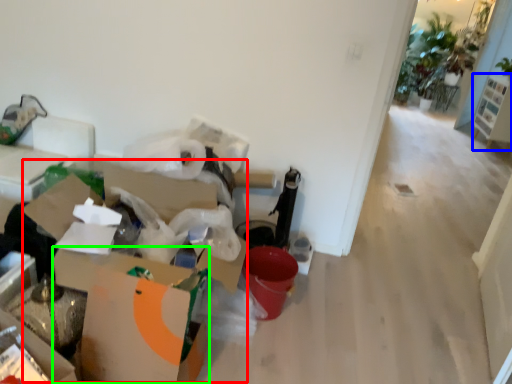
Question: Estimate the real-world distances between objects in this image. Which object is closer to cardboard box (highlighted by a red box), furniture (highlighted by a blue box) or cardboard box (highlighted by a green box)?

Choices:
 (A) furniture
 (B) cardboard box

Answer: (B)